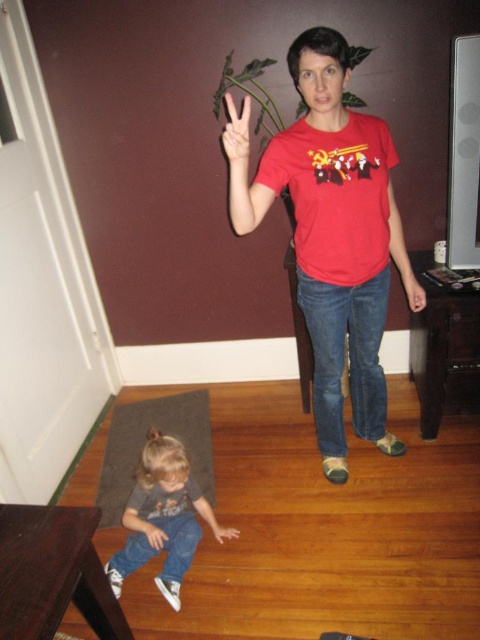
You are a photographer in the room and want to capture both smooth skin hand at lower left and smooth skin hand at lower center in a single photo. Can you position yourself so that both hands are visible without any obstruction?

The smooth skin hand at lower left is located above the smooth skin hand at lower center, so yes, you can position yourself to capture both hands in the photo as they are stacked vertically.